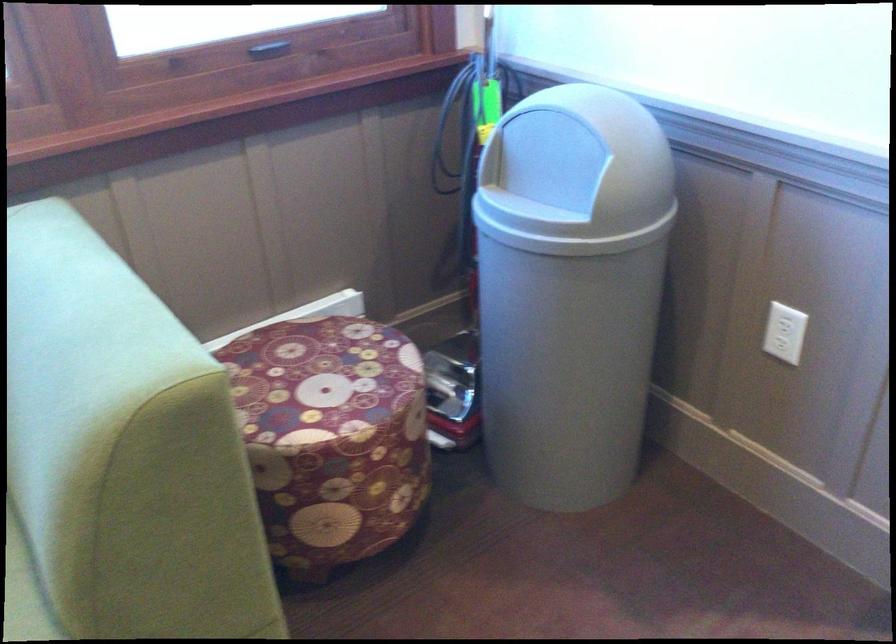
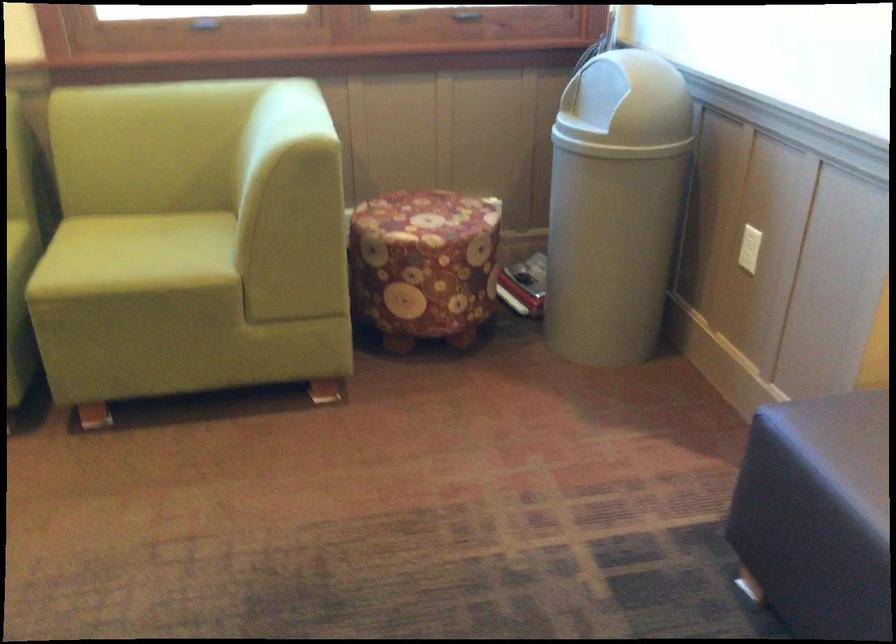
The images are taken continuously from a first-person perspective. In which direction are you moving?

The movement direction of the cameraman is right, backward.